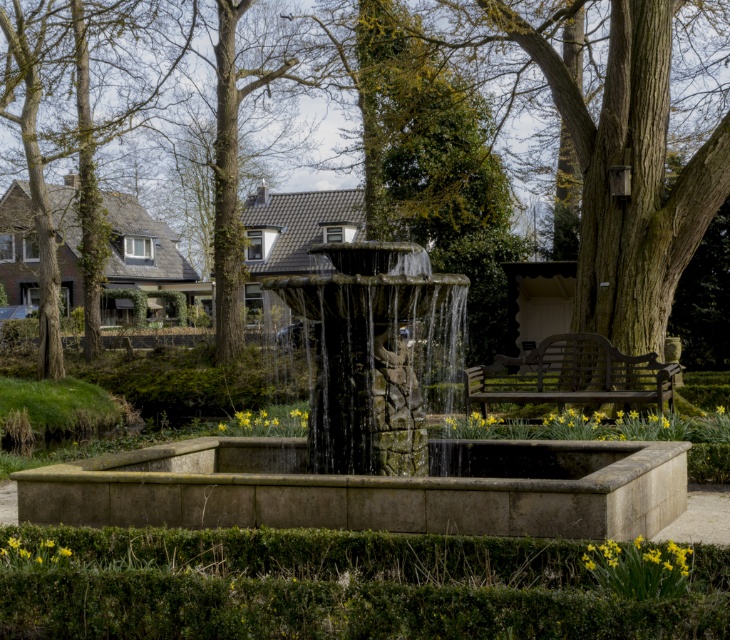
Can you confirm if green leafy tree at center is bigger than stone textured fountain at center?

Yes.

Is point (58, 13) more distant than point (420, 420)?

Yes, it is.

Locate an element on the screen. green leafy tree at center is located at coordinates (622, 145).

Can you confirm if green leafy tree at center is shorter than wooden bench at center?

Incorrect, green leafy tree at center's height does not fall short of wooden bench at center's.

Who is taller, green leafy tree at center or wooden bench at center?

green leafy tree at center

In order to click on green leafy tree at center in this screenshot , I will do `click(622, 145)`.

At what (x,y) coordinates should I click in order to perform the action: click on green leafy tree at center. Please return your answer as a coordinate pair (x, y). The height and width of the screenshot is (640, 730). Looking at the image, I should click on (622, 145).

Based on the photo, between stone fountain at center and stone textured fountain at center, which one has less height?

stone fountain at center is shorter.

Can you confirm if stone fountain at center is bigger than stone textured fountain at center?

Yes.

Is point (368, 336) positioned after point (358, 307)?

That is True.

This screenshot has width=730, height=640. In order to click on stone fountain at center in this screenshot , I will do `click(369, 449)`.